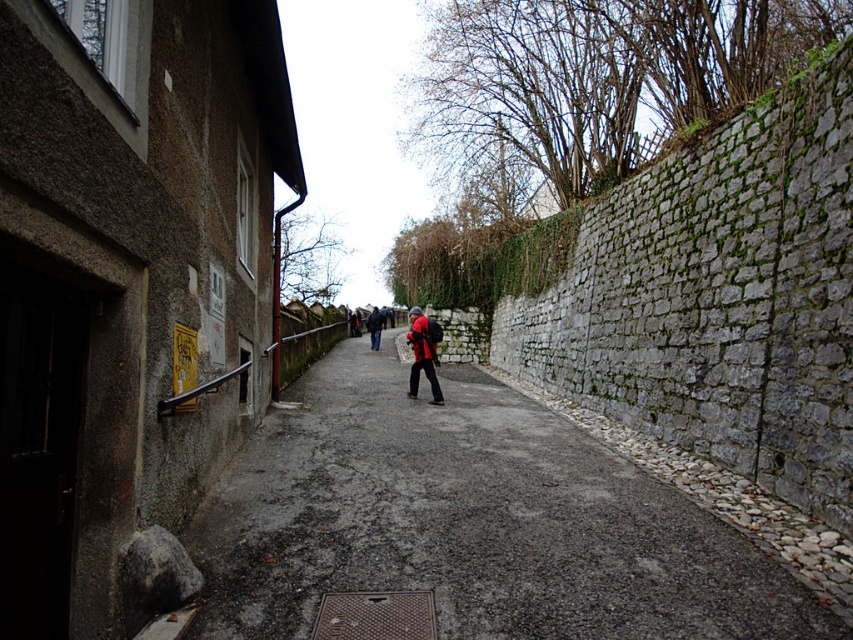
You are standing on the cobblestone pathway and see two jackets lying at the center. The matte red jacket at center and the dark blue jacket at center. Which one is positioned more to the right?

Result: The matte red jacket at center is positioned to the right of the dark blue jacket at center, so the matte red jacket at center is more to the right.

You are a hiker carrying a backpack and see both the matte red jacket at center and the dark blue jacket at center on the narrow cobblestone pathway. The path is only 3 feet wide. Can you safely walk between them without stepping off the path?

The distance between the matte red jacket at center and the dark blue jacket at center is 50.78 feet, which is much greater than the 3 feet width of the path. Therefore, there is sufficient space to walk between them without leaving the path.

You are a delivery person carrying a large box that is 1 meter wide. You see the matte black jacket at center and the matte red jacket at center on the pathway. Can you pass between them without moving either jacket?

The matte black jacket at center might be wider than the matte red jacket at center, so the total width between them may vary. If the space is at least 1 meter wide, you can pass. However, since the black jacket could be wider, it might reduce the available space. Check the actual distance before proceeding.